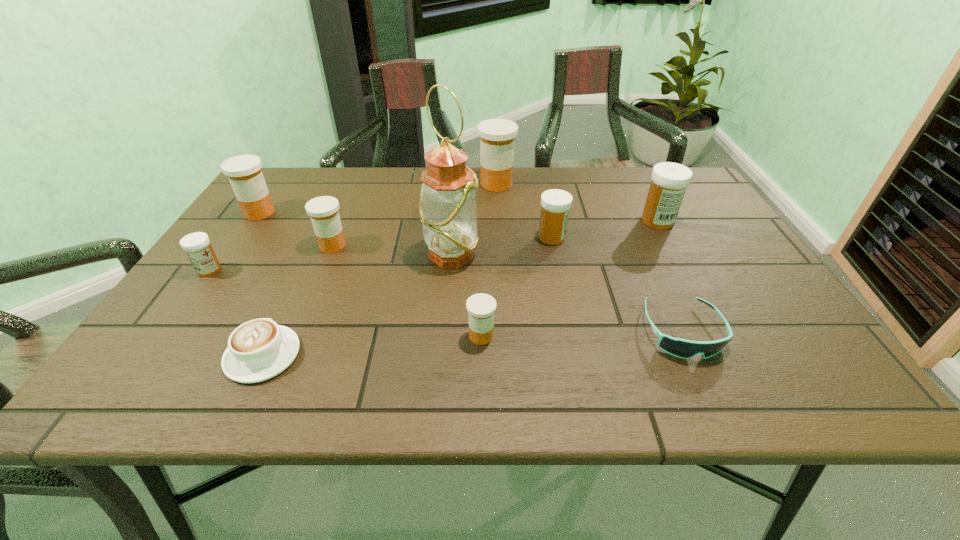
I want to click on oil lamp, so click(x=447, y=208).

The height and width of the screenshot is (540, 960). What are the coordinates of `the tallest medicine` in the screenshot? It's located at (497, 136).

The height and width of the screenshot is (540, 960). Identify the location of the biggest orange medicine. (497, 136).

You are a GUI agent. You are given a task and a screenshot of the screen. Output one action in this format:
    pyautogui.click(x=<x>, y=<y>)
    Task: Click on the leftmost orange medicine
    This screenshot has height=540, width=960.
    Given the screenshot: What is the action you would take?
    pyautogui.click(x=244, y=172)

The image size is (960, 540). Find the location of `the third smallest orange medicine`. the third smallest orange medicine is located at coordinates (244, 172).

Find the location of `the rightmost white medicine`. the rightmost white medicine is located at coordinates (669, 181).

Identify the location of the biggest white medicine. This screenshot has width=960, height=540. (669, 181).

The width and height of the screenshot is (960, 540). I want to click on the second nearest orange medicine, so click(323, 211).

In order to click on the third biggest orange medicine in this screenshot , I will do `click(323, 211)`.

I want to click on the second biggest white medicine, so click(x=555, y=204).